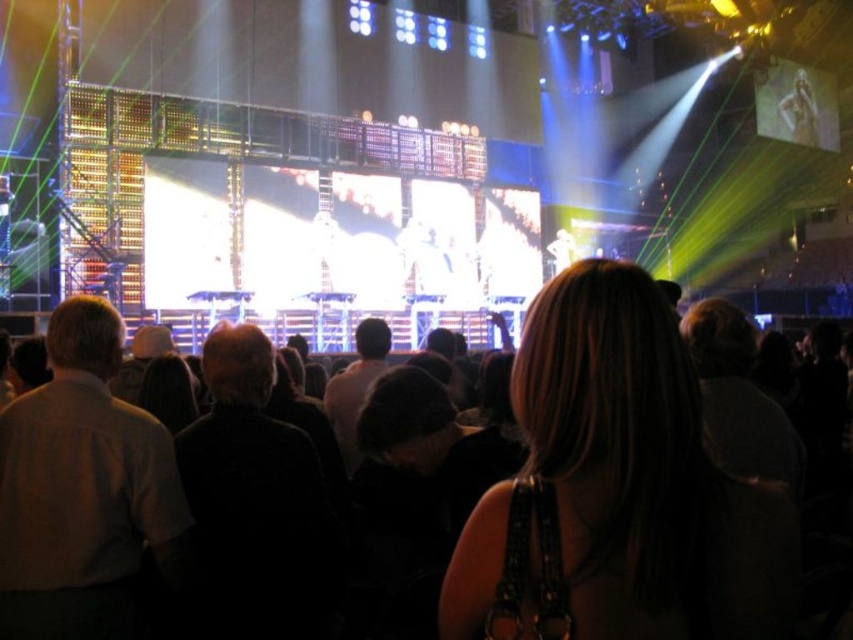
You are sitting in the audience at the concert and want to wave to a friend who is wearing a light brown shirt at left and another friend with dark hair at center. Which friend can you see more clearly from your current seat?

The light brown shirt at left is closer to the viewer than dark hair at center, so you can see the light brown shirt at left more clearly.

You are standing at the camera position and want to hand a gift to the person wearing the dark gray sweater at center. Considering the distance, can you reach them without moving from your current spot?

The dark gray sweater at center is 139.94 feet away from the camera, so you cannot reach them without moving closer.

You are an event planner trying to arrange a photo shoot for a promotional poster. You want to ensure that both the light brown shirt at left and the dark hair at center are visible in the photo. Given their heights, which person should be positioned closer to the camera to ensure both are fully visible?

The light brown shirt at left is much taller than dark hair at center. To ensure both are fully visible, the dark hair at center should be positioned closer to the camera so that their entire body is captured without being obscured by the taller individual.